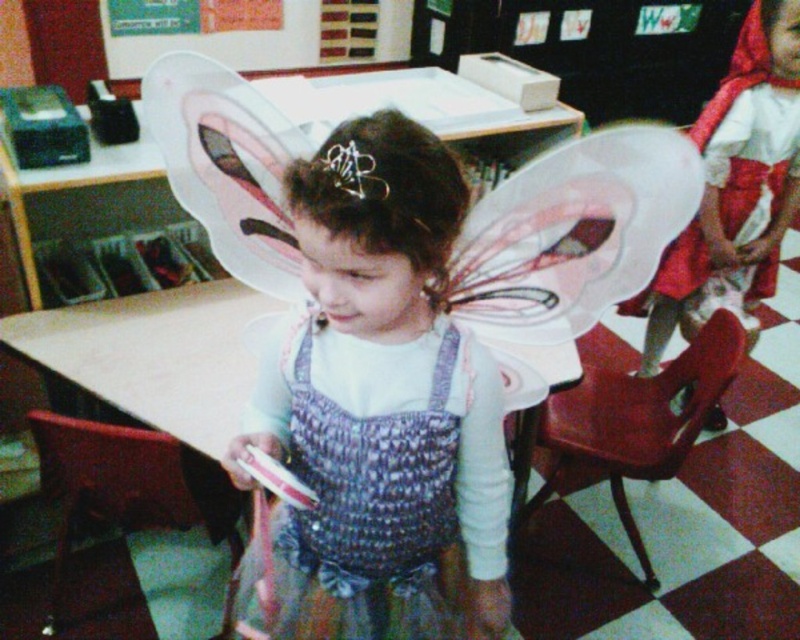
Question: Which point is closer to the camera?

Choices:
 (A) matte red dress at right
 (B) matte pink wings at center
 (C) silver metallic tiara at center

Answer: (B)

Question: Which point is closer to the camera taking this photo?

Choices:
 (A) (368, 173)
 (B) (370, 556)

Answer: (A)

Question: Does matte pink wings at center have a lesser width compared to matte red dress at right?

Choices:
 (A) no
 (B) yes

Answer: (A)

Question: Does matte pink wings at center come in front of matte red dress at right?

Choices:
 (A) yes
 (B) no

Answer: (A)

Question: Among these points, which one is farthest from the camera?

Choices:
 (A) (705, 122)
 (B) (374, 170)

Answer: (A)

Question: Does matte pink wings at center appear on the right side of matte red dress at right?

Choices:
 (A) no
 (B) yes

Answer: (A)